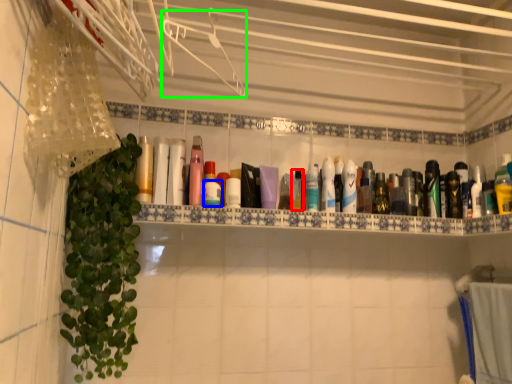
Question: Which object is positioned farthest from mouthwash (highlighted by a red box)? Select from mouthwash (highlighted by a blue box) and hanger (highlighted by a green box).

Choices:
 (A) mouthwash
 (B) hanger

Answer: (B)